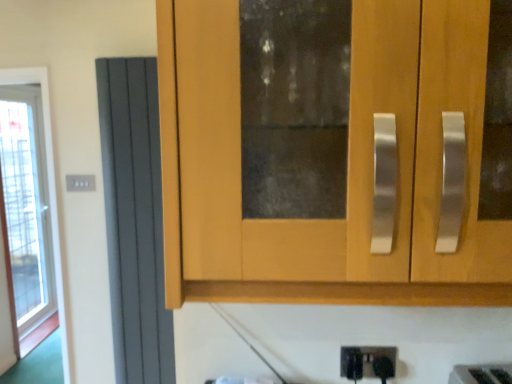
Question: From the image's perspective, is matte gray radiator at left above or below white plastic electric outlet at upper left?

Choices:
 (A) below
 (B) above

Answer: (A)

Question: Considering the positions of matte gray radiator at left and white plastic electric outlet at upper left in the image, is matte gray radiator at left bigger or smaller than white plastic electric outlet at upper left?

Choices:
 (A) small
 (B) big

Answer: (B)

Question: Considering their positions, is matte gray radiator at left located in front of or behind white plastic electric outlet at upper left?

Choices:
 (A) behind
 (B) front

Answer: (B)

Question: Considering their positions, is white plastic electric outlet at upper left located in front of or behind matte gray radiator at left?

Choices:
 (A) behind
 (B) front

Answer: (A)

Question: Looking at their shapes, would you say white plastic electric outlet at upper left is wider or thinner than matte gray radiator at left?

Choices:
 (A) thin
 (B) wide

Answer: (A)

Question: From a real-world perspective, is white plastic electric outlet at upper left physically located above or below matte gray radiator at left?

Choices:
 (A) below
 (B) above

Answer: (B)

Question: Is white plastic electric outlet at upper left spatially inside matte gray radiator at left, or outside of it?

Choices:
 (A) outside
 (B) inside

Answer: (A)